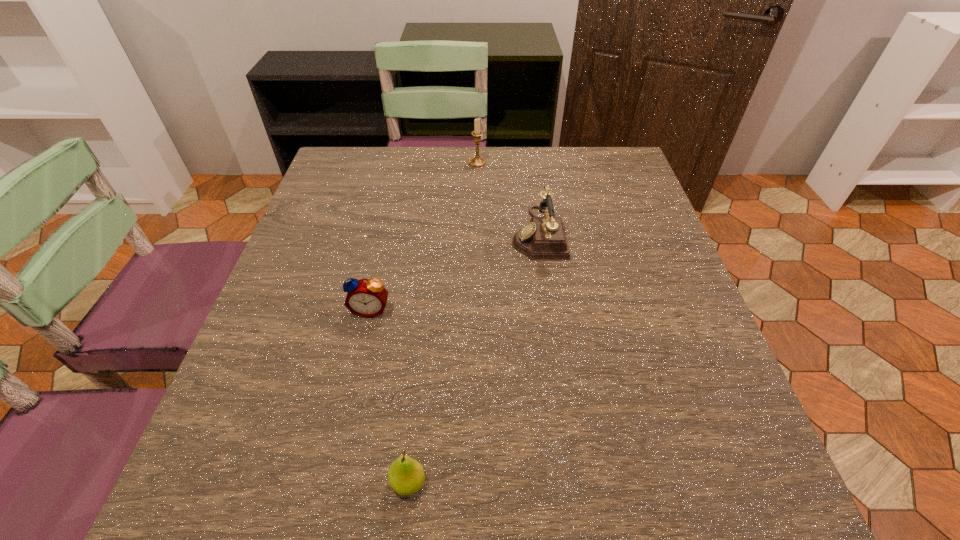
Locate an element on the screen. vacant space located on the dial of the rightmost object is located at coordinates (486, 233).

This screenshot has width=960, height=540. In order to click on vacant region located 0.190m on the dial of the rightmost object in this screenshot , I will do `click(430, 233)`.

Image resolution: width=960 pixels, height=540 pixels. I want to click on vacant region located on the front-facing side of the leftmost object, so click(358, 367).

Identify the location of vacant point located 0.150m on the back of the second object from left to right. (420, 379).

Find the location of a particular element. The image size is (960, 540). object at the far edge is located at coordinates (477, 161).

You are a GUI agent. You are given a task and a screenshot of the screen. Output one action in this format:
    pyautogui.click(x=<x>, y=<y>)
    Task: Click on the object positioned at the near edge
    The height and width of the screenshot is (540, 960).
    Given the screenshot: What is the action you would take?
    pyautogui.click(x=406, y=476)

Image resolution: width=960 pixels, height=540 pixels. In the image, there is a desktop. What are the coordinates of `vacant region at the far edge` in the screenshot? It's located at (443, 148).

Where is `vacant position at the near edge of the desktop`? Image resolution: width=960 pixels, height=540 pixels. vacant position at the near edge of the desktop is located at coordinates (299, 511).

At what (x,y) coordinates should I click in order to perform the action: click on free space at the left edge of the desktop. Please return your answer as a coordinate pair (x, y). Looking at the image, I should click on (287, 444).

This screenshot has width=960, height=540. In the image, there is a desktop. Identify the location of free region at the right edge. (660, 251).